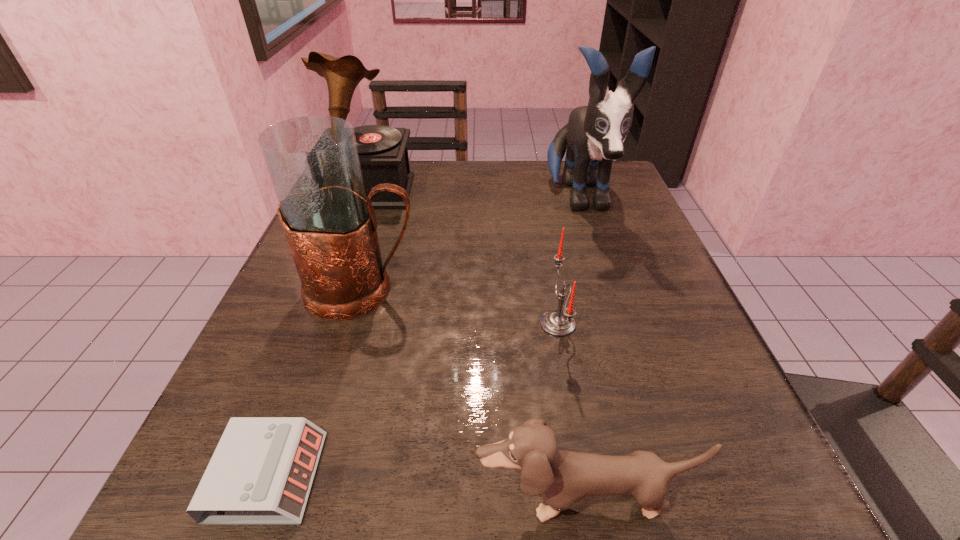
Find the location of a particular element. This screenshot has width=960, height=540. empty space that is in between the phonograph_record and the candle is located at coordinates (464, 257).

Identify the location of free spot between the pitcher and the alarm clock. The height and width of the screenshot is (540, 960). (315, 383).

Locate an element on the screen. The width and height of the screenshot is (960, 540). vacant area between the candle and the nearer puppy is located at coordinates click(x=569, y=411).

I want to click on vacant space in between the candle and the farther puppy, so click(x=568, y=261).

The height and width of the screenshot is (540, 960). In order to click on vacant area that lies between the alarm clock and the phonograph_record in this screenshot , I will do `click(319, 334)`.

At what (x,y) coordinates should I click in order to perform the action: click on vacant area between the taller puppy and the shortest object. Please return your answer as a coordinate pair (x, y). Looking at the image, I should click on (423, 338).

Where is `unoccupied position between the phonograph_record and the alarm clock`? This screenshot has width=960, height=540. unoccupied position between the phonograph_record and the alarm clock is located at coordinates (319, 334).

Locate an element on the screen. vacant point located between the pitcher and the candle is located at coordinates (460, 306).

This screenshot has height=540, width=960. Find the location of `object that is the fourth nearest to the shorter puppy`. object that is the fourth nearest to the shorter puppy is located at coordinates (594, 135).

Where is `object that is the fifth closest to the pitcher`? object that is the fifth closest to the pitcher is located at coordinates (594, 135).